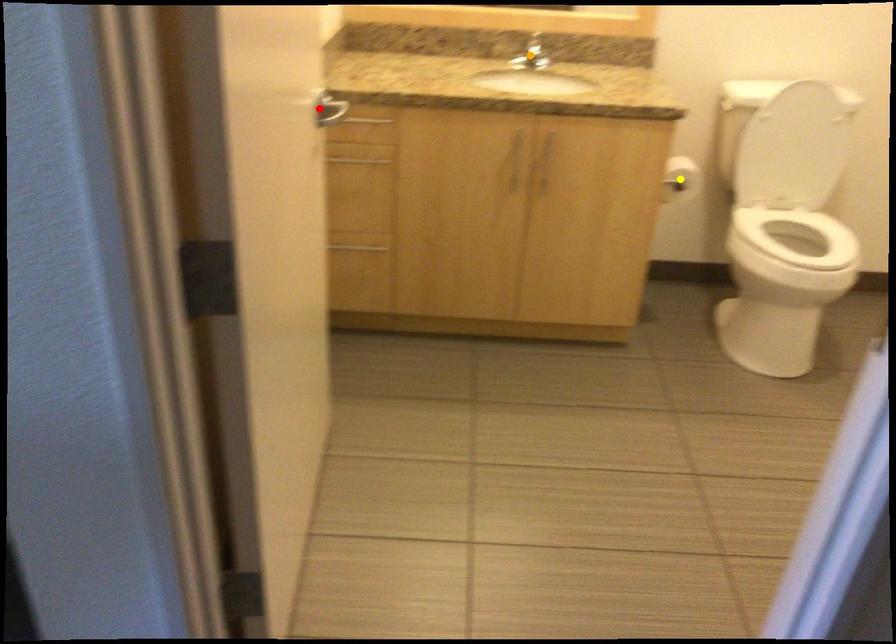
Order these from nearest to farthest:
red point, orange point, yellow point

1. red point
2. yellow point
3. orange point